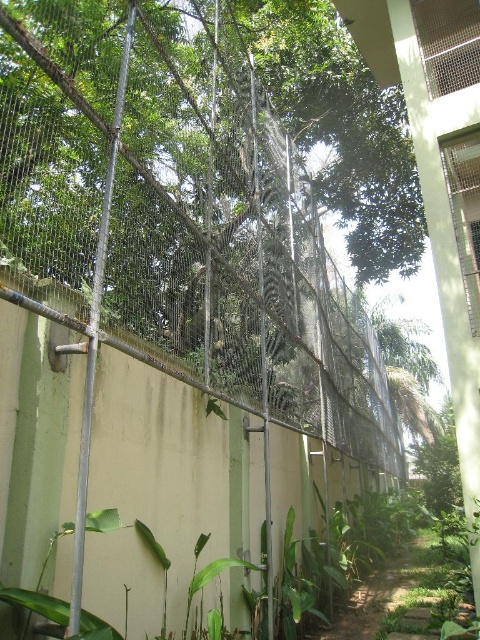
Can you confirm if dirt path at lower center is positioned to the right of green leafy tree at right?

No, dirt path at lower center is not to the right of green leafy tree at right.

Which is in front, point (432, 561) or point (456, 456)?

Positioned in front is point (432, 561).

Find the location of `dirt path at lower center`. dirt path at lower center is located at coordinates (396, 595).